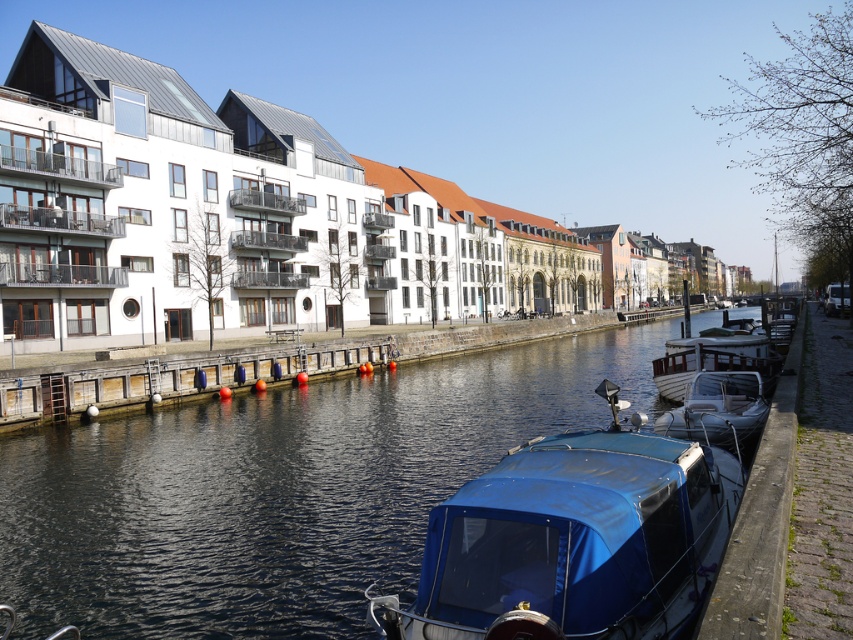
You are planning to dock your small boat at the center of the canal. The blue tarpaulin boat at center and the smooth wooden dock at center are both in your way. Which one should you move to make space for your boat?

You should move the blue tarpaulin boat at center because it occupies less space than the smooth wooden dock at center, making it easier to move out of the way.

You are a delivery person needing to unload a package onto the smooth wooden dock at center from the white matte boat at right. Considering the dock and boat sizes, will you have enough space to maneuver the package onto the dock?

The smooth wooden dock at center is wider than the white matte boat at right, so there should be sufficient space to maneuver the package onto the dock since the dock is wider than the boat.

You are standing on the smooth wooden dock at center and want to board the white matte boat at right. Is the boat above or below the dock?

The smooth wooden dock at center is below the white matte boat at right, so the boat is above the dock. You can board the boat by moving upward from the dock.